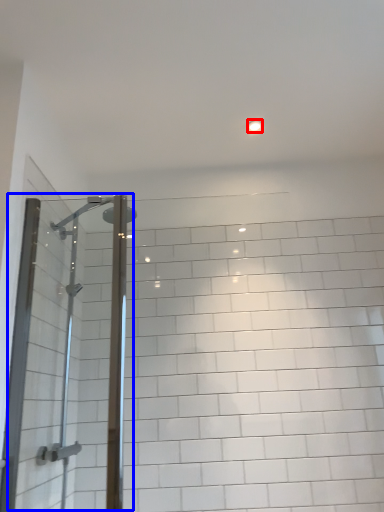
Question: Which of the following is the closest to the observer, light fixture (highlighted by a red box) or screen door (highlighted by a blue box)?

Choices:
 (A) light fixture
 (B) screen door

Answer: (B)